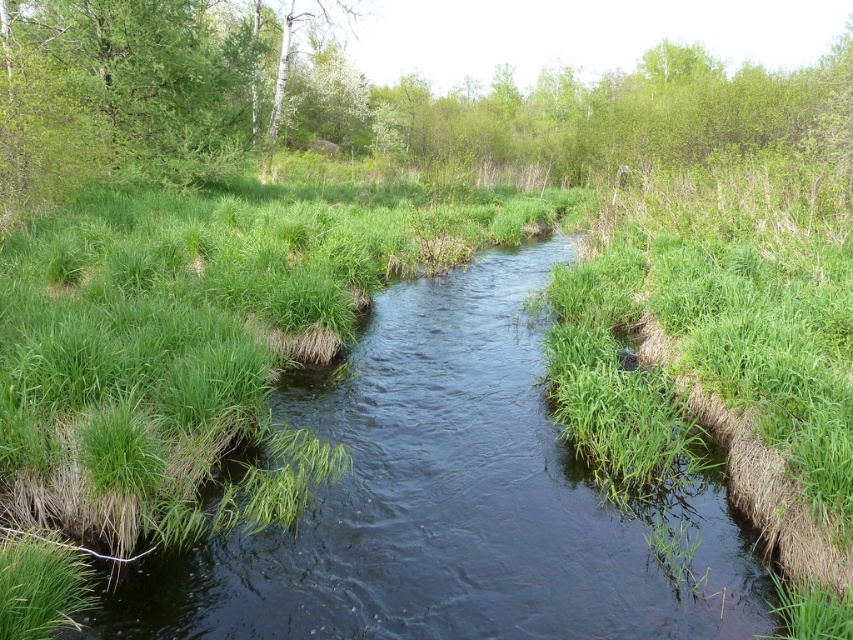
Question: Does green grassy stream at center appear on the right side of green leafy trees at upper center?

Choices:
 (A) yes
 (B) no

Answer: (B)

Question: Which point is closer to the camera?

Choices:
 (A) green leafy trees at upper center
 (B) green grassy stream at center

Answer: (B)

Question: Is green grassy stream at center to the right of green leafy trees at upper center from the viewer's perspective?

Choices:
 (A) yes
 (B) no

Answer: (B)

Question: Is green grassy stream at center below green leafy trees at upper center?

Choices:
 (A) no
 (B) yes

Answer: (B)

Question: Which object appears farthest from the camera in this image?

Choices:
 (A) green leafy trees at upper center
 (B) green grassy stream at center

Answer: (A)